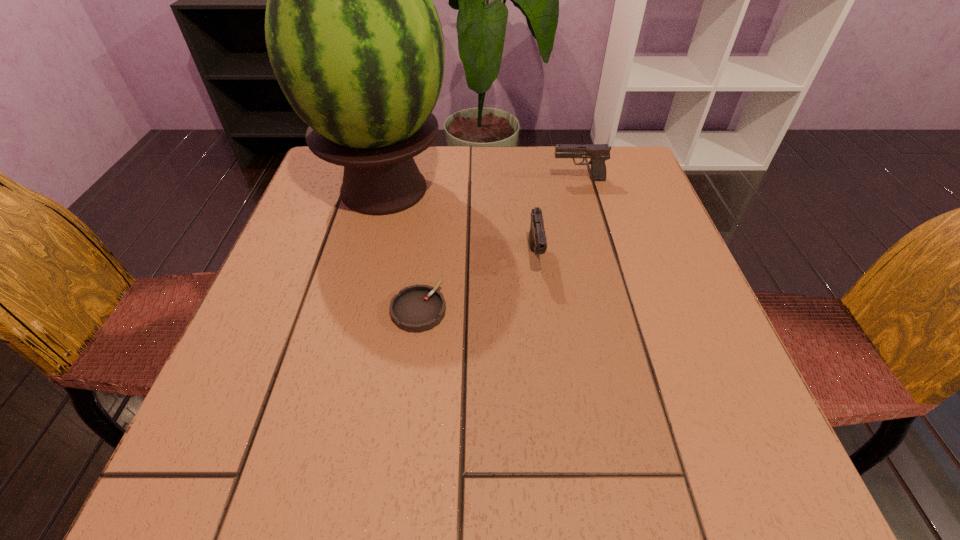
At what (x,y) coordinates should I click in order to perform the action: click on vacant area between the tallest object and the farther pistol. Please return your answer as a coordinate pair (x, y). This screenshot has width=960, height=540. Looking at the image, I should click on (482, 185).

I want to click on free space between the rightmost object and the nearer pistol, so click(557, 218).

This screenshot has width=960, height=540. In order to click on empty space between the shortest object and the second object from right to left in this screenshot , I will do `click(477, 283)`.

You are a GUI agent. You are given a task and a screenshot of the screen. Output one action in this format:
    pyautogui.click(x=<x>, y=<y>)
    Task: Click on the vacant area between the nearest object and the watermelon
    Image resolution: width=960 pixels, height=540 pixels.
    Given the screenshot: What is the action you would take?
    pyautogui.click(x=401, y=249)

Find the location of a particular element. The width and height of the screenshot is (960, 540). blank region between the farther pistol and the tallest object is located at coordinates (482, 185).

The height and width of the screenshot is (540, 960). I want to click on empty space between the ashtray and the watermelon, so click(x=401, y=249).

The width and height of the screenshot is (960, 540). What are the coordinates of `the second closest object to the shortest object` in the screenshot? It's located at (x=537, y=239).

Locate an element on the screen. The image size is (960, 540). the closest object to the second object from right to left is located at coordinates (418, 308).

Locate an element on the screen. This screenshot has height=540, width=960. vacant point that satisfies the following two spatial constraints: 1. aim along the barrel of the right pistol; 2. at the barrel of the left pistol is located at coordinates (599, 256).

Where is `free space that satisfies the following two spatial constraints: 1. aim along the barrel of the right pistol; 2. at the barrel of the left pistol`? This screenshot has height=540, width=960. free space that satisfies the following two spatial constraints: 1. aim along the barrel of the right pistol; 2. at the barrel of the left pistol is located at coordinates (599, 256).